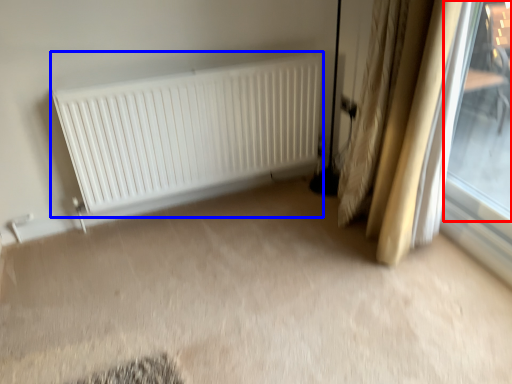
Question: Which of the following is the farthest to the observer, window (highlighted by a red box) or radiator (highlighted by a blue box)?

Choices:
 (A) window
 (B) radiator

Answer: (B)